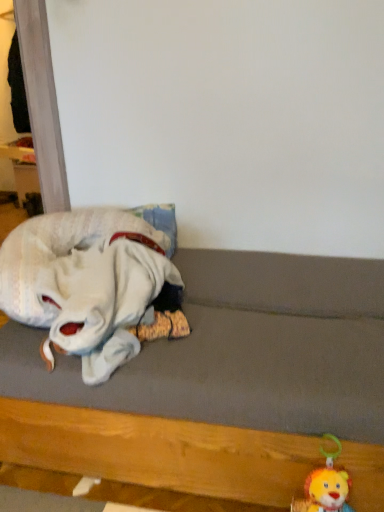
Image resolution: width=384 pixels, height=512 pixels. What do you see at coordinates (221, 385) in the screenshot?
I see `wooden bed frame at lower left` at bounding box center [221, 385].

Identify the location of wooden bed frame at lower left. (221, 385).

The width and height of the screenshot is (384, 512). Describe the element at coordinates (325, 485) in the screenshot. I see `fluffy plush lion at lower right, which is counted as the 2th toy, starting from the top` at that location.

In order to face white plush toy at left, placed as the 1th toy when sorted from top to bottom, should I rotate leftwards or rightwards?

Turn left by 12.336 degrees to look at white plush toy at left, placed as the 1th toy when sorted from top to bottom.

Image resolution: width=384 pixels, height=512 pixels. What are the coordinates of `white plush toy at left, placed as the 1th toy when sorted from top to bottom` in the screenshot? It's located at (87, 284).

Where is `wooden bed frame at lower left`? This screenshot has height=512, width=384. wooden bed frame at lower left is located at coordinates (221, 385).

Which is correct: wooden bed frame at lower left is inside fluffy plush lion at lower right, the 1th toy ordered from the bottom, or outside of it?

wooden bed frame at lower left is located beyond the bounds of fluffy plush lion at lower right, the 1th toy ordered from the bottom.

From the image's perspective, is wooden bed frame at lower left on top of fluffy plush lion at lower right, which is counted as the 2th toy, starting from the top?

Yes, from the image's perspective, wooden bed frame at lower left is over fluffy plush lion at lower right, which is counted as the 2th toy, starting from the top.

Considering the relative sizes of wooden bed frame at lower left and fluffy plush lion at lower right, the first toy from the right, in the image provided, is wooden bed frame at lower left wider than fluffy plush lion at lower right, the first toy from the right,?

Yes.

From a real-world perspective, is fluffy plush lion at lower right, which is the second toy from left to right, physically located above or below wooden bed frame at lower left?

Clearly, from a real-world perspective, fluffy plush lion at lower right, which is the second toy from left to right, is below wooden bed frame at lower left.

Can you see fluffy plush lion at lower right, which is the second toy from left to right, touching wooden bed frame at lower left?

fluffy plush lion at lower right, which is the second toy from left to right, is not next to wooden bed frame at lower left, and they're not touching.

This screenshot has height=512, width=384. What are the coordinates of `toy lying below the wooden bed frame at lower left (from the image's perspective)` in the screenshot? It's located at (325, 485).

Considering the positions of objects fluffy plush lion at lower right, which is the second toy from left to right, and wooden bed frame at lower left in the image provided, who is more to the right, fluffy plush lion at lower right, which is the second toy from left to right, or wooden bed frame at lower left?

Positioned to the right is fluffy plush lion at lower right, which is the second toy from left to right.

Is there a large distance between fluffy plush lion at lower right, which is counted as the 2th toy, starting from the top, and white plush toy at left, the 1th toy in the left-to-right sequence?

Actually, fluffy plush lion at lower right, which is counted as the 2th toy, starting from the top, and white plush toy at left, the 1th toy in the left-to-right sequence, are a little close together.

Does fluffy plush lion at lower right, the 1th toy ordered from the bottom, come behind white plush toy at left, the second toy viewed from the right?

No, it is not.

From the image's perspective, which is below, fluffy plush lion at lower right, the 1th toy ordered from the bottom, or white plush toy at left, the 1th toy in the left-to-right sequence?

fluffy plush lion at lower right, the 1th toy ordered from the bottom, from the image's perspective.

Can you confirm if fluffy plush lion at lower right, which is the second toy from left to right, is bigger than white plush toy at left, placed as the 1th toy when sorted from top to bottom?

Incorrect, fluffy plush lion at lower right, which is the second toy from left to right, is not larger than white plush toy at left, placed as the 1th toy when sorted from top to bottom.

Which is correct: white plush toy at left, the second toy viewed from the right, is inside wooden bed frame at lower left, or outside of it?

white plush toy at left, the second toy viewed from the right, is located inside wooden bed frame at lower left.

Which is more to the right, white plush toy at left, the second toy viewed from the right, or wooden bed frame at lower left?

From the viewer's perspective, wooden bed frame at lower left appears more on the right side.

Does wooden bed frame at lower left have a lesser height compared to white plush toy at left, marked as the second toy in a bottom-to-top arrangement?

No.

Is wooden bed frame at lower left next to white plush toy at left, the second toy viewed from the right?

No.

Between wooden bed frame at lower left and white plush toy at left, the second toy viewed from the right, which one has smaller size?

white plush toy at left, the second toy viewed from the right, is smaller.

Considering the positions of objects wooden bed frame at lower left and white plush toy at left, the 1th toy in the left-to-right sequence, in the image provided, who is more to the left, wooden bed frame at lower left or white plush toy at left, the 1th toy in the left-to-right sequence,?

From the viewer's perspective, white plush toy at left, the 1th toy in the left-to-right sequence, appears more on the left side.

Considering the relative sizes of white plush toy at left, placed as the 1th toy when sorted from top to bottom, and fluffy plush lion at lower right, which is the second toy from left to right, in the image provided, is white plush toy at left, placed as the 1th toy when sorted from top to bottom, taller than fluffy plush lion at lower right, which is the second toy from left to right,?

Incorrect, the height of white plush toy at left, placed as the 1th toy when sorted from top to bottom, is not larger of that of fluffy plush lion at lower right, which is the second toy from left to right.

In the scene shown: Is white plush toy at left, the second toy viewed from the right, beside fluffy plush lion at lower right, which is the second toy from left to right?

No, white plush toy at left, the second toy viewed from the right, is not in contact with fluffy plush lion at lower right, which is the second toy from left to right.

Considering the relative sizes of white plush toy at left, marked as the second toy in a bottom-to-top arrangement, and fluffy plush lion at lower right, the 1th toy ordered from the bottom, in the image provided, is white plush toy at left, marked as the second toy in a bottom-to-top arrangement, thinner than fluffy plush lion at lower right, the 1th toy ordered from the bottom,?

In fact, white plush toy at left, marked as the second toy in a bottom-to-top arrangement, might be wider than fluffy plush lion at lower right, the 1th toy ordered from the bottom.

Considering the points (104, 216) and (332, 477), which point is behind, point (104, 216) or point (332, 477)?

The point (104, 216) is farther from the camera.

This screenshot has height=512, width=384. What are the coordinates of `bed frame that appears above the fluffy plush lion at lower right, which is counted as the 2th toy, starting from the top (from the image's perspective)` in the screenshot? It's located at 221,385.

The image size is (384, 512). In the image, there is a wooden bed frame at lower left. What are the coordinates of `toy below it (from the image's perspective)` in the screenshot? It's located at (325, 485).

Based on their spatial positions, is fluffy plush lion at lower right, which is the second toy from left to right, or white plush toy at left, placed as the 1th toy when sorted from top to bottom, closer to wooden bed frame at lower left?

Based on the image, white plush toy at left, placed as the 1th toy when sorted from top to bottom, appears to be nearer to wooden bed frame at lower left.

When comparing their distances from fluffy plush lion at lower right, the 1th toy ordered from the bottom, does white plush toy at left, marked as the second toy in a bottom-to-top arrangement, or wooden bed frame at lower left seem closer?

Among the two, wooden bed frame at lower left is located nearer to fluffy plush lion at lower right, the 1th toy ordered from the bottom.

Looking at the image, which one is located closer to white plush toy at left, the second toy viewed from the right, wooden bed frame at lower left or fluffy plush lion at lower right, which is the second toy from left to right?

wooden bed frame at lower left is positioned closer to the anchor white plush toy at left, the second toy viewed from the right.

From the image, which object appears to be farther from white plush toy at left, the second toy viewed from the right, fluffy plush lion at lower right, which is counted as the 2th toy, starting from the top, or wooden bed frame at lower left?

fluffy plush lion at lower right, which is counted as the 2th toy, starting from the top, is further to white plush toy at left, the second toy viewed from the right.

Consider the image. Looking at the image, which one is located closer to fluffy plush lion at lower right, the first toy from the right, wooden bed frame at lower left or white plush toy at left, marked as the second toy in a bottom-to-top arrangement?

Based on the image, wooden bed frame at lower left appears to be nearer to fluffy plush lion at lower right, the first toy from the right.

When comparing their distances from wooden bed frame at lower left, does white plush toy at left, the 1th toy in the left-to-right sequence, or fluffy plush lion at lower right, which is the second toy from left to right, seem closer?

white plush toy at left, the 1th toy in the left-to-right sequence, is closer to wooden bed frame at lower left.

Where is `bed frame between white plush toy at left, the 1th toy in the left-to-right sequence, and fluffy plush lion at lower right, the 1th toy ordered from the bottom`? This screenshot has width=384, height=512. bed frame between white plush toy at left, the 1th toy in the left-to-right sequence, and fluffy plush lion at lower right, the 1th toy ordered from the bottom is located at coordinates (221, 385).